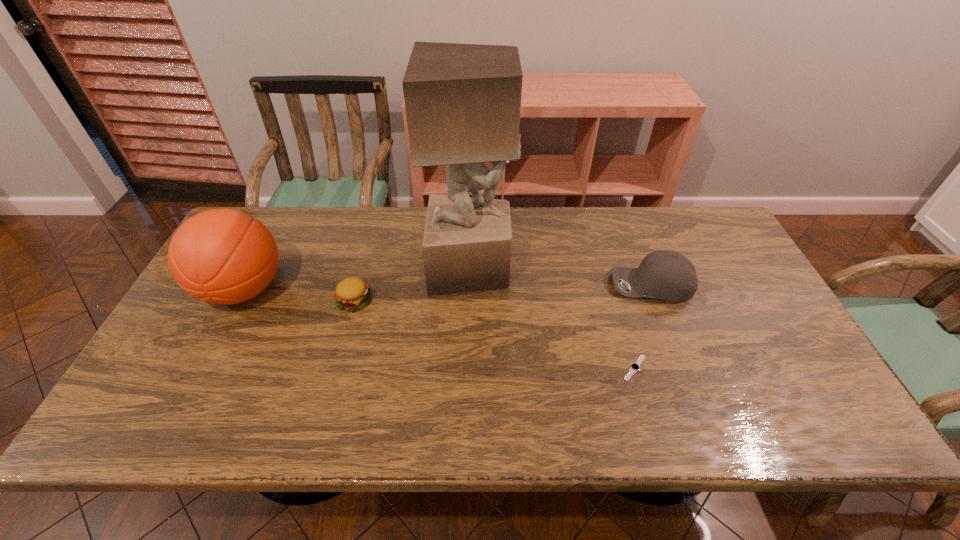
Locate an element on the screen. The width and height of the screenshot is (960, 540). vacant space located 0.320m on the right of the leftmost object is located at coordinates (400, 290).

Find the location of a particular element. Image resolution: width=960 pixels, height=540 pixels. free space located on the front brim of the third tallest object is located at coordinates (486, 285).

Locate an element on the screen. Image resolution: width=960 pixels, height=540 pixels. free space located 0.320m on the front brim of the third tallest object is located at coordinates (499, 285).

The image size is (960, 540). What are the coordinates of `free region located 0.270m on the front brim of the third tallest object` in the screenshot? It's located at coord(516,285).

Where is `free space located on the left of the second shortest object`? free space located on the left of the second shortest object is located at coordinates (279, 301).

Where is `vacant position located on the left of the nearest object`? The width and height of the screenshot is (960, 540). vacant position located on the left of the nearest object is located at coordinates (531, 368).

Where is `object located at the far edge`? This screenshot has height=540, width=960. object located at the far edge is located at coordinates (462, 101).

In order to click on object present at the left edge in this screenshot , I will do `click(222, 256)`.

Locate an element on the screen. free space at the far edge of the desktop is located at coordinates (416, 207).

At what (x,y) coordinates should I click in order to perform the action: click on free space at the near edge. Please return your answer as a coordinate pair (x, y). The width and height of the screenshot is (960, 540). Looking at the image, I should click on (465, 410).